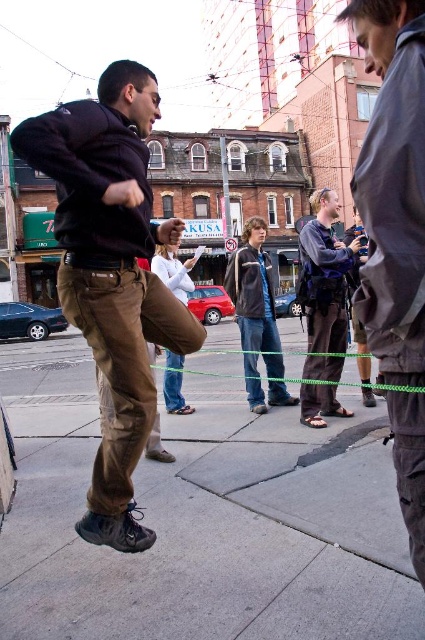
The image size is (425, 640). Find the location of `gray concrete sidewalk at center`. gray concrete sidewalk at center is located at coordinates (203, 520).

Is gray concrete sidewalk at center bigger than matte brown pants at center?

Yes, gray concrete sidewalk at center is bigger than matte brown pants at center.

At what (x,y) coordinates should I click in order to perform the action: click on gray concrete sidewalk at center. Please return your answer as a coordinate pair (x, y). Image resolution: width=425 pixels, height=640 pixels. Looking at the image, I should click on (203, 520).

Is matte brown pants at center positioned behind dark gray fleece jacket at center?

No, matte brown pants at center is in front of dark gray fleece jacket at center.

Is point (76, 253) positioned after point (255, 360)?

No, (76, 253) is closer to viewer.

I want to click on matte brown pants at center, so click(112, 273).

From the picture: Is gray concrete sidewalk at center above dark gray fleece jacket at center?

No, gray concrete sidewalk at center is not above dark gray fleece jacket at center.

Measure the distance from gray concrete sidewalk at center to dark gray fleece jacket at center.

gray concrete sidewalk at center and dark gray fleece jacket at center are 20.35 feet apart from each other.

Who is more distant from viewer, [365,524] or [272,403]?

The point [272,403] is behind.

Locate an element on the screen. The width and height of the screenshot is (425, 640). gray concrete sidewalk at center is located at coordinates (203, 520).